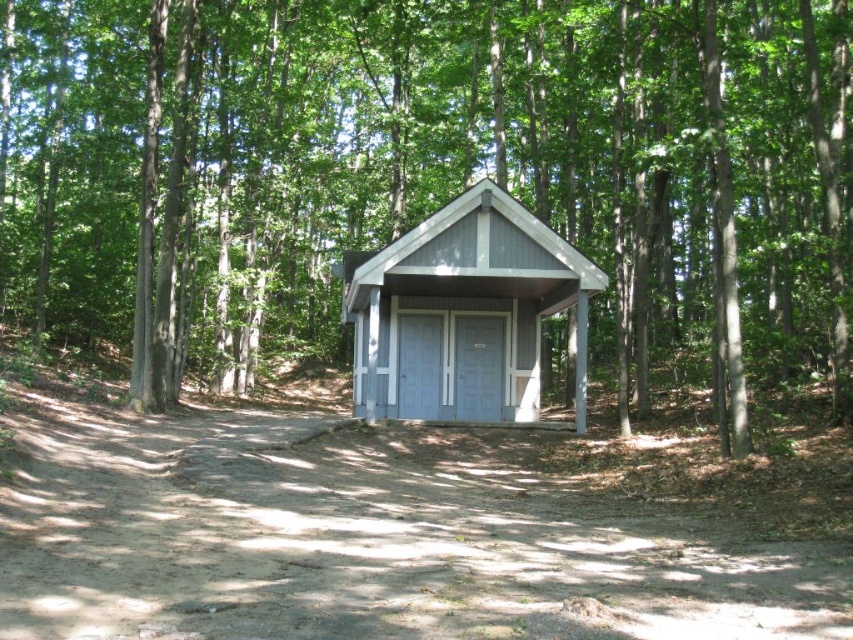
Who is positioned more to the right, green leafy tree at center or gray wood cabin at center?

From the viewer's perspective, green leafy tree at center appears more on the right side.

Does green leafy tree at center have a smaller size compared to gray wood cabin at center?

No, green leafy tree at center is not smaller than gray wood cabin at center.

This screenshot has width=853, height=640. I want to click on green leafy tree at center, so click(x=433, y=188).